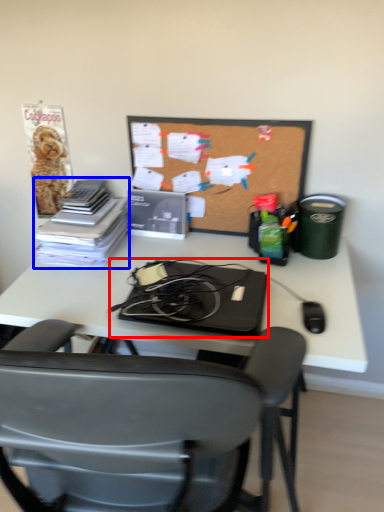
Question: Which object appears farthest to the camera in this image, laptop (highlighted by a red box) or book (highlighted by a blue box)?

Choices:
 (A) laptop
 (B) book

Answer: (B)